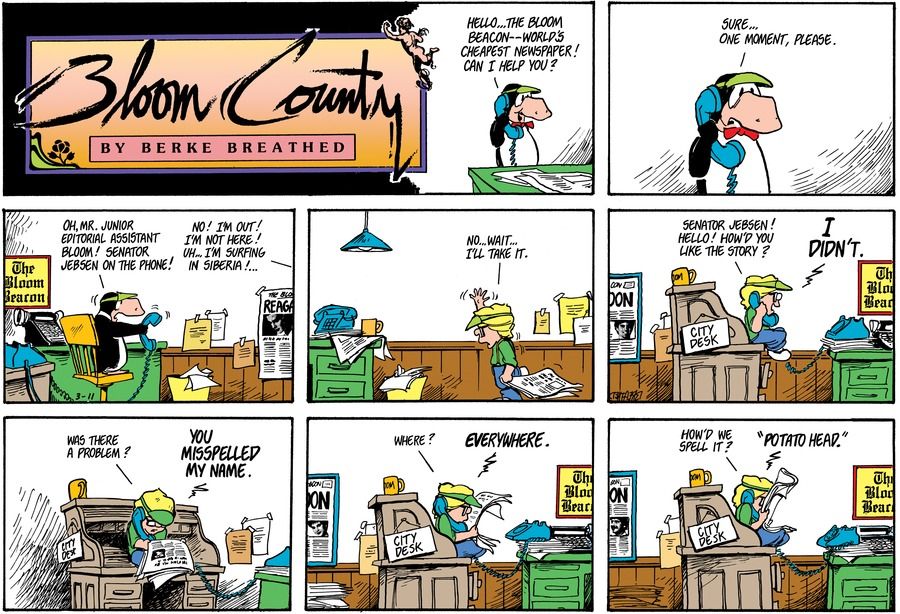
Locate an element on the screen. The height and width of the screenshot is (614, 900). desks is located at coordinates (713, 358), (717, 565), (426, 568), (99, 558), (60, 356), (40, 377), (342, 373), (855, 368), (864, 564), (565, 568).